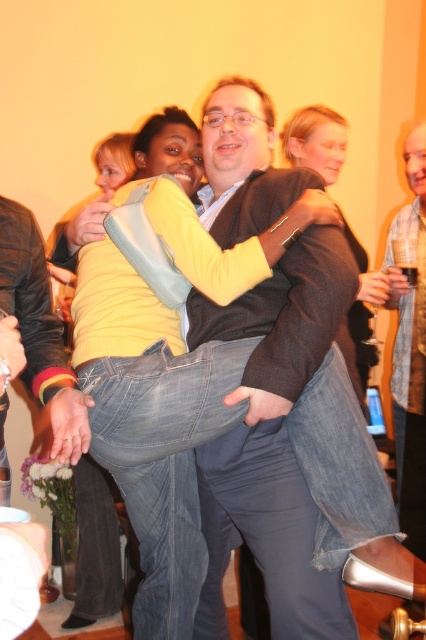
Consider the image. You are at a party and want to take a photo of the matte brown jacket at upper right without the plaid shirt at center blocking the view. Is this possible given their positions?

The matte brown jacket at upper right is behind the plaid shirt at center, so it is currently blocked by the plaid shirt at center. To take a photo of the matte brown jacket at upper right without obstruction, you would need to move around the plaid shirt at center to a position where the plaid shirt at center is no longer between you and the matte brown jacket at upper right.

You are at a party and want to take a photo of the denim jeans at center and the matte brown jacket at upper right. Which object should you focus on first if you want to capture both in the same frame without moving the camera?

You should focus on the denim jeans at center first because it is located below the matte brown jacket at upper right, so adjusting the camera to include both would require ensuring the lower object is in frame first.

Looking at this image, you are standing in the room and want to reach a point that is exactly at coordinate point (311, 243). If you are currently 1.5 meters away from the camera, how much closer do you need to move to reach that point?

The point (311, 243) is 1.20 meters from the camera. Since you are currently 1.5 meters away, you need to move 0.3 meters closer to reach it.